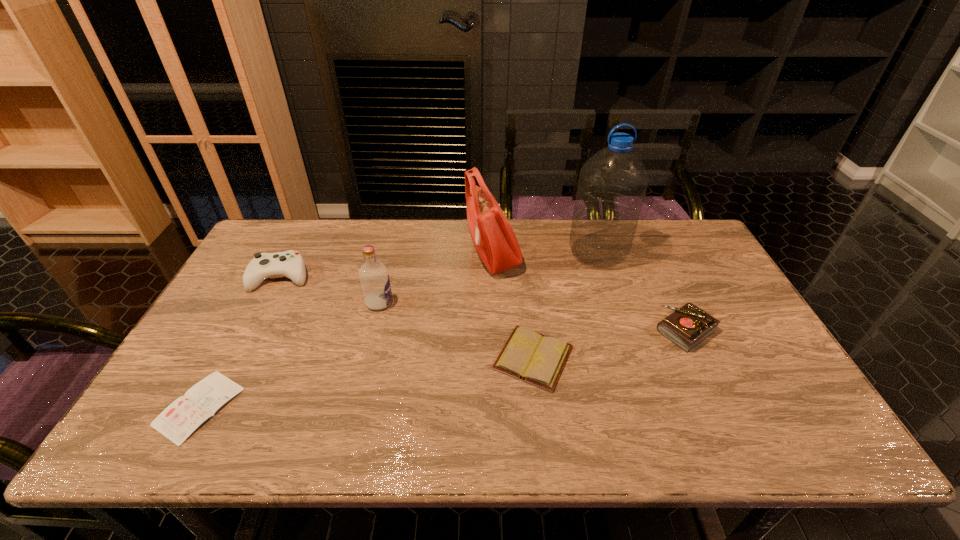
In order to click on vacant space at the near left corner of the desktop in this screenshot , I will do `click(153, 433)`.

In the image, there is a desktop. Identify the location of free space at the far right corner. (710, 255).

Find the location of a particular element. This screenshot has height=540, width=960. free region at the near right corner of the desktop is located at coordinates (805, 442).

Where is `vacant space that is in between the control and the vodka`? vacant space that is in between the control and the vodka is located at coordinates (330, 290).

Image resolution: width=960 pixels, height=540 pixels. In order to click on free space between the sixth tallest object and the tallest diary in this screenshot , I will do `click(610, 344)`.

The image size is (960, 540). I want to click on free space between the tallest diary and the second diary from left to right, so click(x=610, y=344).

You are a GUI agent. You are given a task and a screenshot of the screen. Output one action in this format:
    pyautogui.click(x=<x>, y=<y>)
    Task: Click on the empty space that is in between the tallest object and the fourth tallest object
    The image size is (960, 540).
    Given the screenshot: What is the action you would take?
    pyautogui.click(x=440, y=265)

Where is `free spot between the handbag and the water jug`? free spot between the handbag and the water jug is located at coordinates (545, 255).

Image resolution: width=960 pixels, height=540 pixels. Find the location of `free space that is in between the fourth tallest object and the vodka`. free space that is in between the fourth tallest object and the vodka is located at coordinates (330, 290).

Identify the location of empty space between the handbag and the tallest object. (545, 255).